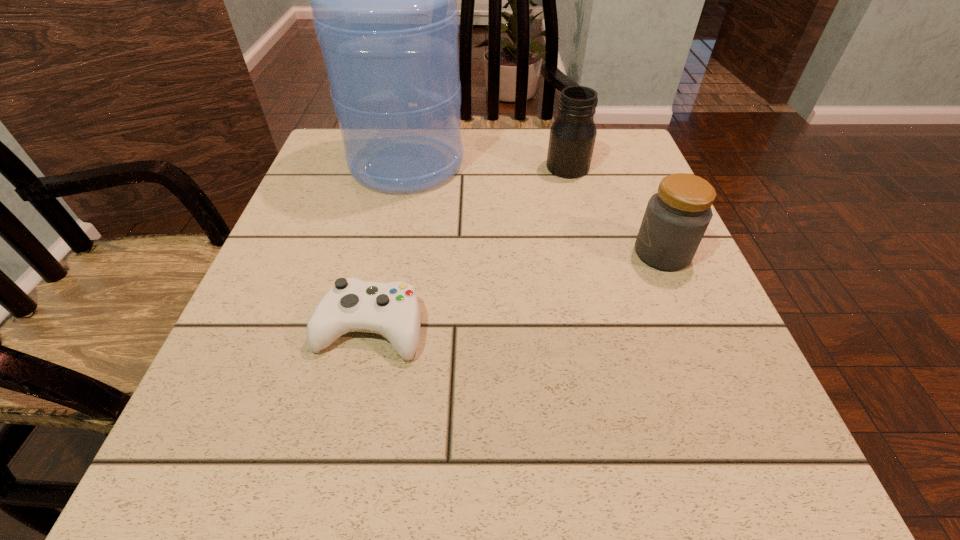
I want to click on free space between the second object from right to left and the water jug, so click(x=487, y=166).

Find the location of `unoccupied area between the shortest object and the farther jar`. unoccupied area between the shortest object and the farther jar is located at coordinates (468, 247).

The width and height of the screenshot is (960, 540). What are the coordinates of `vacant region between the right jar and the water jug` in the screenshot? It's located at (535, 208).

Identify the location of free space between the control and the nearer jar. (516, 291).

Find the location of a particular element. object that ranks as the closest to the second object from right to left is located at coordinates (384, 7).

Locate an element on the screen. The height and width of the screenshot is (540, 960). object that ranks as the closest to the shorter jar is located at coordinates (572, 137).

I want to click on vacant area in the image that satisfies the following two spatial constraints: 1. on the surface of the nearer jar near the warning symbol; 2. on the front side of the nearest object, so click(x=694, y=328).